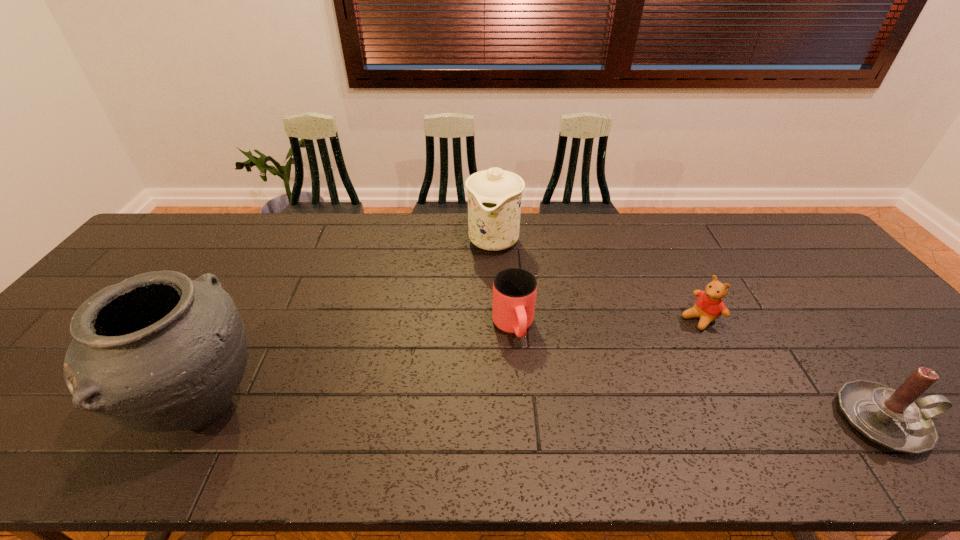
Find the location of `vacant spot on the desktop that is between the urn and the third tallest object and is positioned on the handle side of the cup`. vacant spot on the desktop that is between the urn and the third tallest object and is positioned on the handle side of the cup is located at coordinates (540, 414).

Identify the location of vacant spot on the desktop that is between the leftmost object and the candle and is positioned on the spout of the chinaware. (444, 411).

In order to click on vacant space on the desktop that is between the urn and the third shortest object and is positioned on the front-facing side of the fourth object from left to right in this screenshot , I will do `click(540, 414)`.